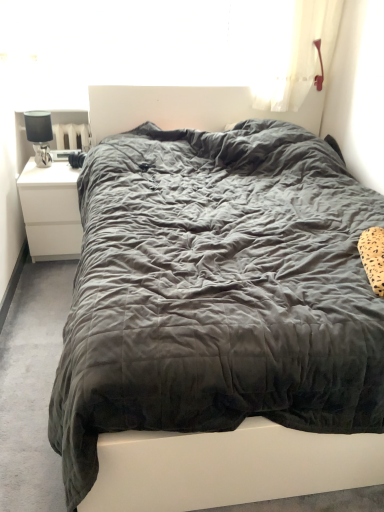
Question: Visually, is dark grey quilted bed at center positioned to the left or to the right of transparent plastic window screen at upper center?

Choices:
 (A) left
 (B) right

Answer: (B)

Question: From a real-world perspective, relative to transparent plastic window screen at upper center, is dark grey quilted bed at center vertically above or below?

Choices:
 (A) above
 (B) below

Answer: (B)

Question: Which is nearer to the dark grey quilted bed at center?

Choices:
 (A) white matte nightstand at left
 (B) satin black lamp at left
 (C) transparent plastic window screen at upper center

Answer: (A)

Question: Which object is the farthest from the transparent plastic window screen at upper center?

Choices:
 (A) satin black lamp at left
 (B) white matte nightstand at left
 (C) dark grey quilted bed at center

Answer: (C)